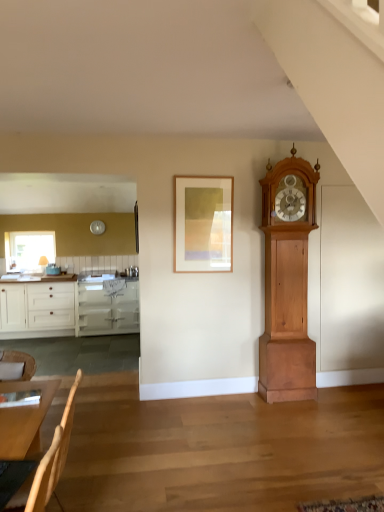
Question: Does light brown wooden table at lower left have a lesser height compared to wooden picture frame at center?

Choices:
 (A) yes
 (B) no

Answer: (A)

Question: Does light brown wooden table at lower left appear on the left side of wooden picture frame at center?

Choices:
 (A) no
 (B) yes

Answer: (B)

Question: Considering the relative sizes of light brown wooden table at lower left and wooden picture frame at center in the image provided, is light brown wooden table at lower left taller than wooden picture frame at center?

Choices:
 (A) no
 (B) yes

Answer: (A)

Question: Is light brown wooden table at lower left facing towards wooden picture frame at center?

Choices:
 (A) no
 (B) yes

Answer: (A)

Question: From the image's perspective, is light brown wooden table at lower left located beneath wooden picture frame at center?

Choices:
 (A) no
 (B) yes

Answer: (B)

Question: Do you think white glossy cabinetry at left is within matte glass window at left, or outside of it?

Choices:
 (A) inside
 (B) outside

Answer: (B)

Question: From the image's perspective, is white glossy cabinetry at left located above or below matte glass window at left?

Choices:
 (A) above
 (B) below

Answer: (B)

Question: Considering the positions of point (29, 310) and point (43, 251), is point (29, 310) closer or farther from the camera than point (43, 251)?

Choices:
 (A) farther
 (B) closer

Answer: (B)

Question: In terms of height, does white glossy cabinetry at left look taller or shorter compared to matte glass window at left?

Choices:
 (A) tall
 (B) short

Answer: (A)

Question: From a real-world perspective, is light brown wooden grandfather clock at right above or below wooden chair at lower left?

Choices:
 (A) above
 (B) below

Answer: (A)

Question: From the image's perspective, is light brown wooden grandfather clock at right above or below wooden chair at lower left?

Choices:
 (A) above
 (B) below

Answer: (A)

Question: From their relative heights in the image, would you say light brown wooden grandfather clock at right is taller or shorter than wooden chair at lower left?

Choices:
 (A) tall
 (B) short

Answer: (A)

Question: Visually, is light brown wooden grandfather clock at right positioned to the left or to the right of wooden chair at lower left?

Choices:
 (A) left
 (B) right

Answer: (B)

Question: From the image's perspective, is light brown wooden grandfather clock at right positioned above or below light brown wooden table at lower left?

Choices:
 (A) below
 (B) above

Answer: (B)

Question: In terms of height, does light brown wooden grandfather clock at right look taller or shorter compared to light brown wooden table at lower left?

Choices:
 (A) tall
 (B) short

Answer: (A)